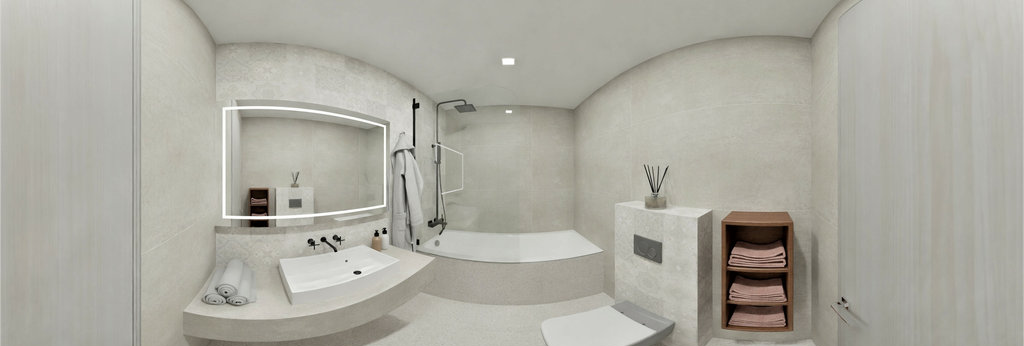
What are the coordinates of `robe` in the screenshot? It's located at (404, 177).